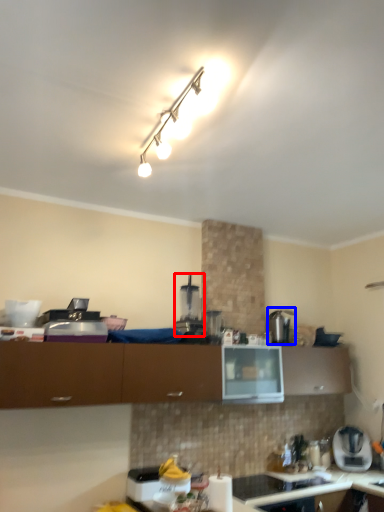
Question: Among these objects, which one is nearest to the camera, coffee machine (highlighted by a red box) or appliance (highlighted by a blue box)?

Choices:
 (A) coffee machine
 (B) appliance

Answer: (A)